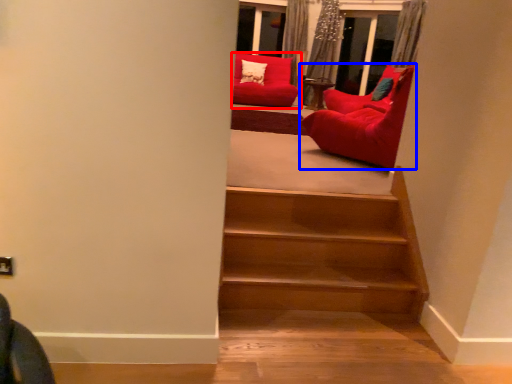
Question: Which object appears farthest to the camera in this image, chair (highlighted by a red box) or chair (highlighted by a blue box)?

Choices:
 (A) chair
 (B) chair

Answer: (A)